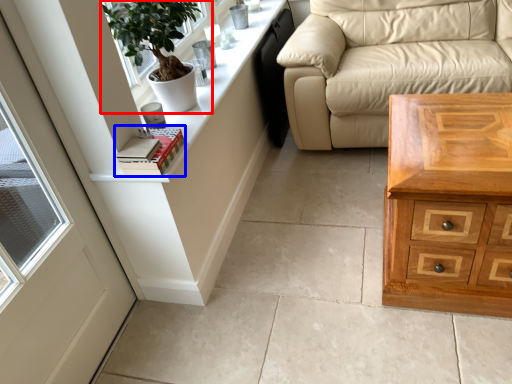
Question: Which object is closer to the camera taking this photo, houseplant (highlighted by a red box) or book (highlighted by a blue box)?

Choices:
 (A) houseplant
 (B) book

Answer: (B)